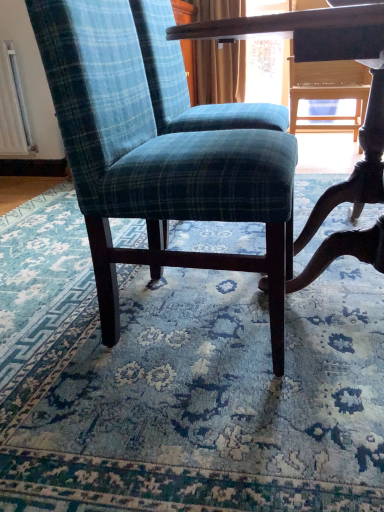
Question: From a real-world perspective, is teal plaid fabric chair at center above or below blue plaid fabric chair at center?

Choices:
 (A) below
 (B) above

Answer: (B)

Question: Considering the positions of teal plaid fabric chair at center and blue plaid fabric chair at center in the image, is teal plaid fabric chair at center taller or shorter than blue plaid fabric chair at center?

Choices:
 (A) short
 (B) tall

Answer: (B)

Question: Is teal plaid fabric chair at center bigger or smaller than blue plaid fabric chair at center?

Choices:
 (A) big
 (B) small

Answer: (A)

Question: From the image's perspective, is blue plaid fabric chair at center located above or below teal plaid fabric chair at center?

Choices:
 (A) below
 (B) above

Answer: (A)

Question: Considering the positions of blue plaid fabric chair at center and teal plaid fabric chair at center in the image, is blue plaid fabric chair at center taller or shorter than teal plaid fabric chair at center?

Choices:
 (A) short
 (B) tall

Answer: (A)

Question: Considering the positions of blue plaid fabric chair at center and teal plaid fabric chair at center in the image, is blue plaid fabric chair at center wider or thinner than teal plaid fabric chair at center?

Choices:
 (A) wide
 (B) thin

Answer: (A)

Question: From a real-world perspective, is blue plaid fabric chair at center physically located above or below teal plaid fabric chair at center?

Choices:
 (A) below
 (B) above

Answer: (A)